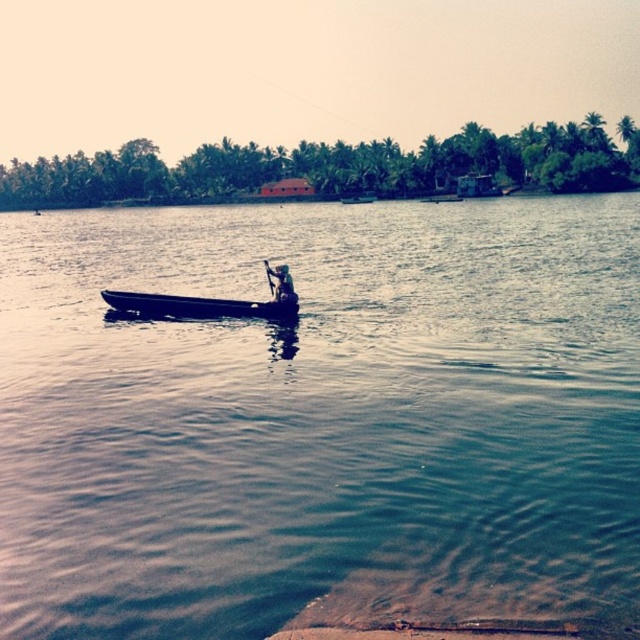
Which of these two, smooth dark wood canoe at center or dark blue fabric boat at center, stands taller?

Standing taller between the two is dark blue fabric boat at center.

Which is behind, point (262, 301) or point (284, 280)?

Point (262, 301)

This screenshot has height=640, width=640. What do you see at coordinates (196, 307) in the screenshot?
I see `smooth dark wood canoe at center` at bounding box center [196, 307].

Identify the location of smooth dark wood canoe at center. Image resolution: width=640 pixels, height=640 pixels. (196, 307).

Is clear blue water at center shorter than dark blue fabric boat at center?

No, clear blue water at center is not shorter than dark blue fabric boat at center.

Is clear blue water at center to the left of dark blue fabric boat at center from the viewer's perspective?

Indeed, clear blue water at center is positioned on the left side of dark blue fabric boat at center.

Is point (336, 566) positioned after point (284, 291)?

No.

This screenshot has width=640, height=640. In order to click on clear blue water at center in this screenshot , I will do [x=321, y=419].

Can you confirm if clear blue water at center is wider than smooth dark wood canoe at center?

Yes.

Based on the photo, measure the distance between point (522, 323) and camera.

The distance of point (522, 323) from camera is 19.31 meters.

The image size is (640, 640). I want to click on clear blue water at center, so click(321, 419).

Image resolution: width=640 pixels, height=640 pixels. Find the location of `clear blue water at center`. clear blue water at center is located at coordinates (321, 419).